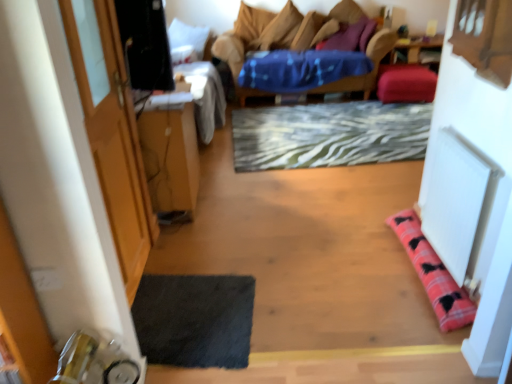
Where is `free spot to the left of pink plaid pillow at lower right, the 3th pillow positioned from the right`? The width and height of the screenshot is (512, 384). free spot to the left of pink plaid pillow at lower right, the 3th pillow positioned from the right is located at coordinates (337, 271).